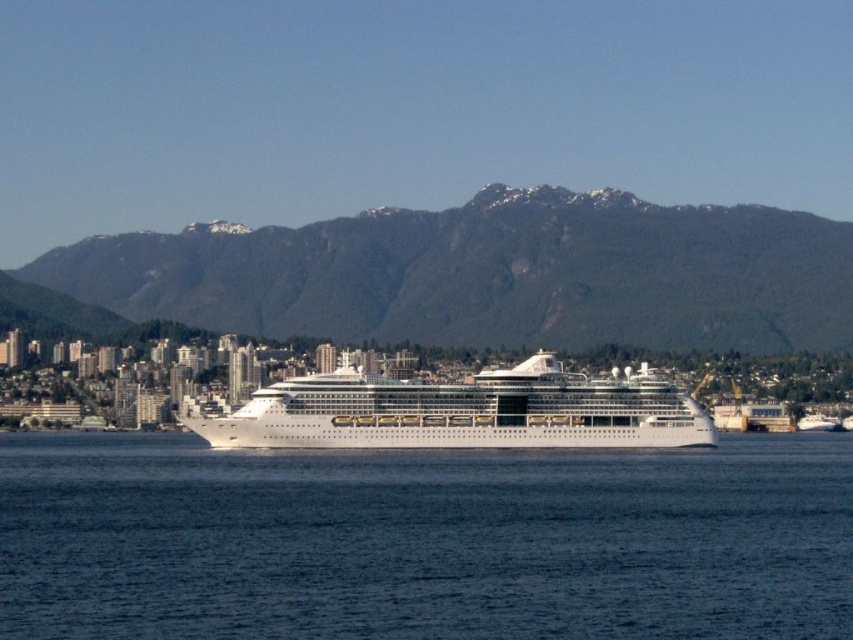
You are standing on the deck of the cruise ship and want to know how far the point at coordinates point [421,257] is from you. Can you determine the distance?

The point point [421,257] is 622.07 meters away from you.

You are standing on the cruise ship and want to take a photo of the blue water at center. Based on its coordinates, where should you aim your camera?

The blue water at center is located at point (x=422, y=541), so you should aim your camera towards the coordinates 0.848 on the horizontal axis and 0.497 on the vertical axis to capture the blue water at center.

You are standing on the deck of the cruise ship and looking out. Which object is directly in front of you between the blue water at center and the green textured mountain at center?

The blue water at center is directly in front of you because it is located below the green textured mountain at center, meaning the mountain is behind the water from your perspective.